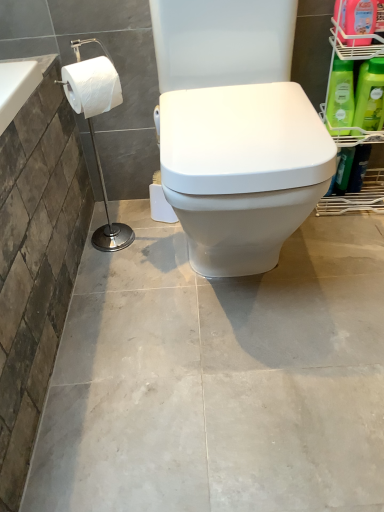
Question: Does white matte toilet paper at left have a lesser width compared to green matte bottle at right, the first cleaning product from the bottom?

Choices:
 (A) no
 (B) yes

Answer: (A)

Question: Is white matte toilet paper at left outside of green matte bottle at right, positioned as the third cleaning product in top-to-bottom order?

Choices:
 (A) yes
 (B) no

Answer: (A)

Question: From the image's perspective, is white matte toilet paper at left above green matte bottle at right, positioned as the third cleaning product in top-to-bottom order?

Choices:
 (A) yes
 (B) no

Answer: (B)

Question: Considering the relative sizes of white matte toilet paper at left and green matte bottle at right, the first cleaning product from the bottom, in the image provided, is white matte toilet paper at left wider than green matte bottle at right, the first cleaning product from the bottom,?

Choices:
 (A) yes
 (B) no

Answer: (A)

Question: Can you confirm if white matte toilet paper at left is shorter than green matte bottle at right, the first cleaning product from the bottom?

Choices:
 (A) no
 (B) yes

Answer: (B)

Question: From the image's perspective, is green plastic shelf at right located above or below pink plastic bottle at upper right, the first cleaning product in the top-to-bottom sequence?

Choices:
 (A) above
 (B) below

Answer: (B)

Question: Choose the correct answer: Is green plastic shelf at right inside pink plastic bottle at upper right, acting as the 3th cleaning product starting from the bottom, or outside it?

Choices:
 (A) outside
 (B) inside

Answer: (A)

Question: In terms of width, does green plastic shelf at right look wider or thinner when compared to pink plastic bottle at upper right, acting as the 3th cleaning product starting from the bottom?

Choices:
 (A) thin
 (B) wide

Answer: (B)

Question: Does point (337, 42) appear closer or farther from the camera than point (370, 31)?

Choices:
 (A) closer
 (B) farther

Answer: (B)

Question: Visually, is white matte toilet paper at left positioned to the left or to the right of green matte bottle at upper right, which is the second cleaning product from top to bottom?

Choices:
 (A) right
 (B) left

Answer: (B)

Question: Looking at the image, does white matte toilet paper at left seem bigger or smaller compared to green matte bottle at upper right, placed as the 2th cleaning product when sorted from bottom to top?

Choices:
 (A) small
 (B) big

Answer: (B)

Question: From a real-world perspective, is white matte toilet paper at left above or below green matte bottle at upper right, placed as the 2th cleaning product when sorted from bottom to top?

Choices:
 (A) above
 (B) below

Answer: (A)

Question: Is white matte toilet paper at left in front of or behind green matte bottle at upper right, placed as the 2th cleaning product when sorted from bottom to top, in the image?

Choices:
 (A) behind
 (B) front

Answer: (B)

Question: In the image, is pink plastic bottle at upper right, the first cleaning product in the top-to-bottom sequence, on the left side or the right side of white glossy toilet at center?

Choices:
 (A) left
 (B) right

Answer: (B)

Question: Is pink plastic bottle at upper right, acting as the 3th cleaning product starting from the bottom, inside or outside of white glossy toilet at center?

Choices:
 (A) outside
 (B) inside

Answer: (A)